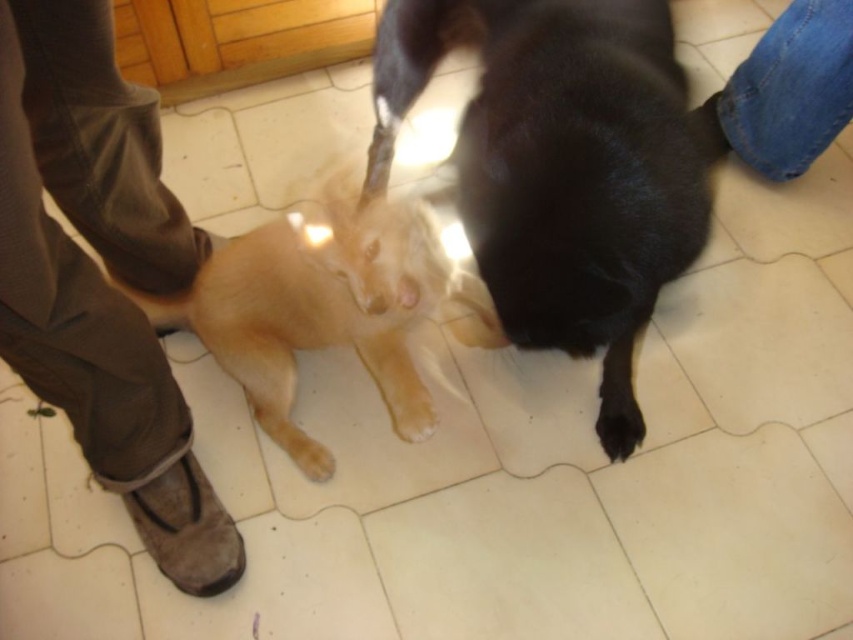
Question: Can you confirm if golden fur dog at center is bigger than black fur paw at lower center?

Choices:
 (A) no
 (B) yes

Answer: (B)

Question: Does brown suede shoe at lower left have a larger size compared to jeans at right?

Choices:
 (A) no
 (B) yes

Answer: (B)

Question: Does brown suede shoe at lower left appear on the left side of jeans at right?

Choices:
 (A) yes
 (B) no

Answer: (A)

Question: Among these objects, which one is nearest to the camera?

Choices:
 (A) jeans at right
 (B) brown suede shoe at lower left
 (C) golden fur dog at center

Answer: (B)

Question: Among these points, which one is farthest from the camera?

Choices:
 (A) (607, 451)
 (B) (697, 227)

Answer: (A)

Question: Among these points, which one is nearest to the camera?

Choices:
 (A) (103, 289)
 (B) (289, 412)
 (C) (770, 141)
 (D) (680, 124)

Answer: (A)